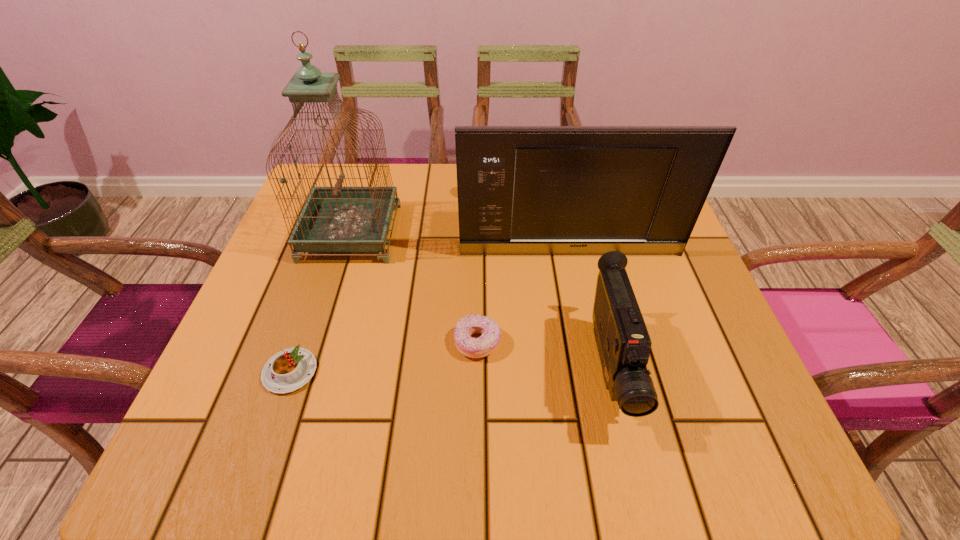
In order to click on free space that satisfies the following two spatial constraints: 1. at the door of the tallest object; 2. on the back side of the doughnut in this screenshot , I will do `click(317, 342)`.

Locate an element on the screen. vacant point that satisfies the following two spatial constraints: 1. at the door of the tallest object; 2. on the front side of the shortest object is located at coordinates click(x=307, y=372).

Identify the location of free space that satisfies the following two spatial constraints: 1. at the door of the second shortest object; 2. on the right side of the tallest object. (317, 342).

Where is `vacant point that satisfies the following two spatial constraints: 1. on the back side of the second shortest object; 2. on the left side of the pudding`? vacant point that satisfies the following two spatial constraints: 1. on the back side of the second shortest object; 2. on the left side of the pudding is located at coordinates (300, 342).